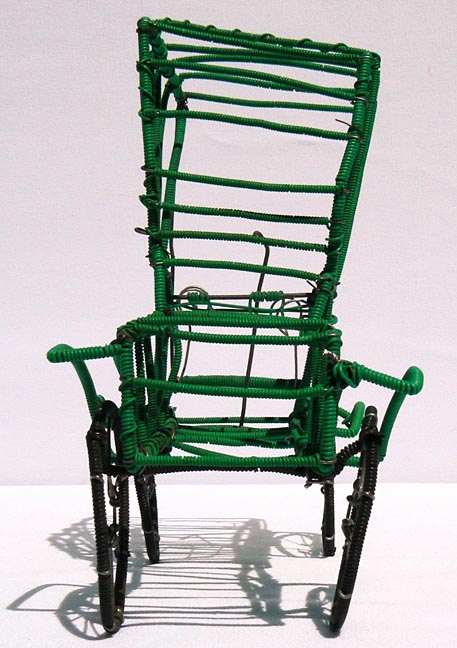
Identify the location of caned green horizontal bar of seat (forward bar). The height and width of the screenshot is (648, 457). (215, 461).